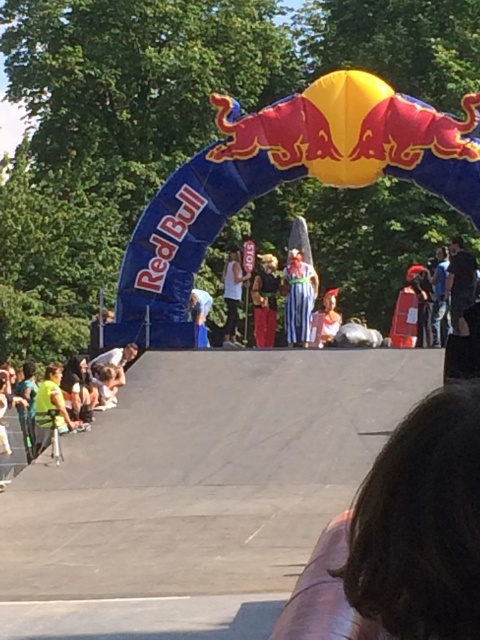
You are at an outdoor event under a bright sunny sky with a large Red Bull archway. You see a point marked at coordinates (50,406). What object is located at that point?

The point at coordinates (50,406) indicates the yellow green shirt at lower left.

You are attending an outdoor event and see a person wearing a black cotton shirt at right and blue denim jeans at center. Which piece of clothing is located more to the right side?

The black cotton shirt at right is positioned on the right side of the blue denim jeans at center, so the black cotton shirt at right is more to the right.